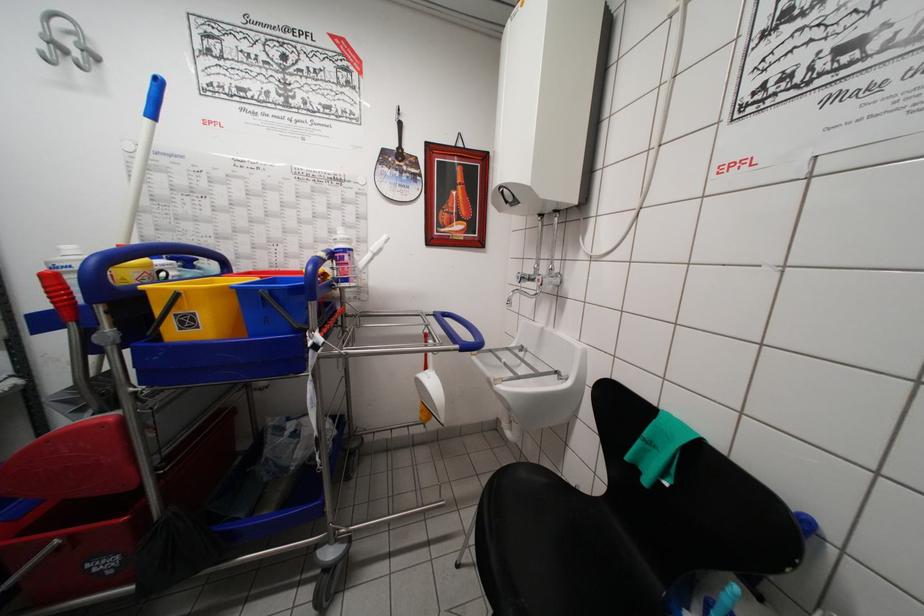
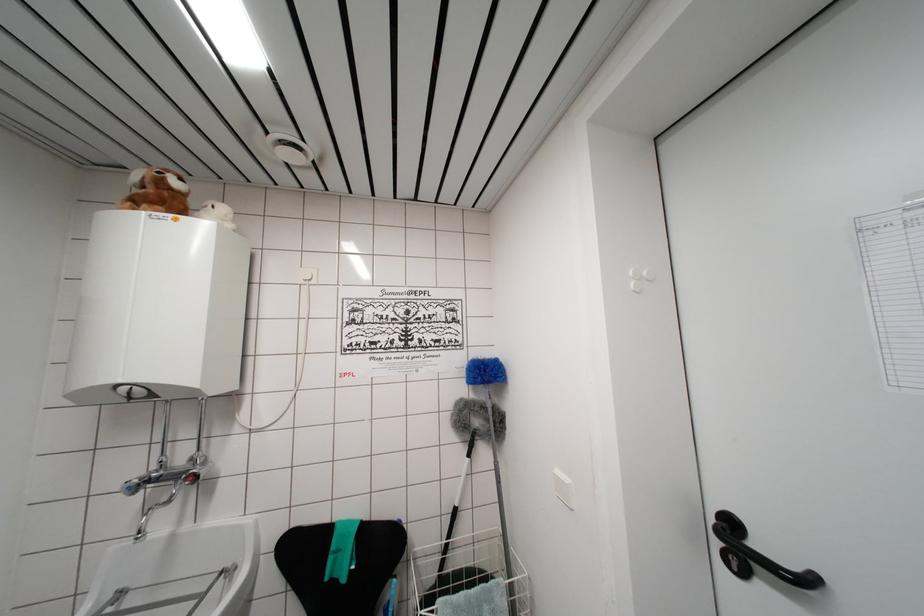
Locate, in the second image, the point that corresponds to point (543, 376) in the first image.

(209, 593)